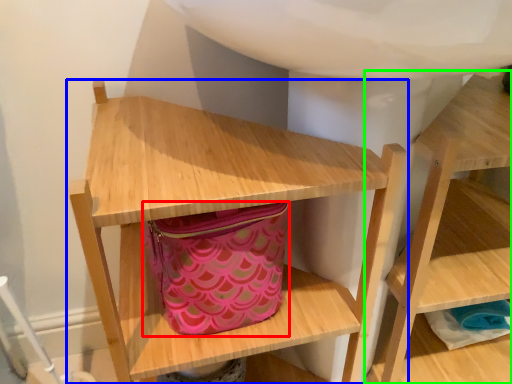
Question: Which object is positioned farthest from bag (highlighted by a red box)? Select from shelf (highlighted by a blue box) and shelf (highlighted by a green box).

Choices:
 (A) shelf
 (B) shelf

Answer: (B)